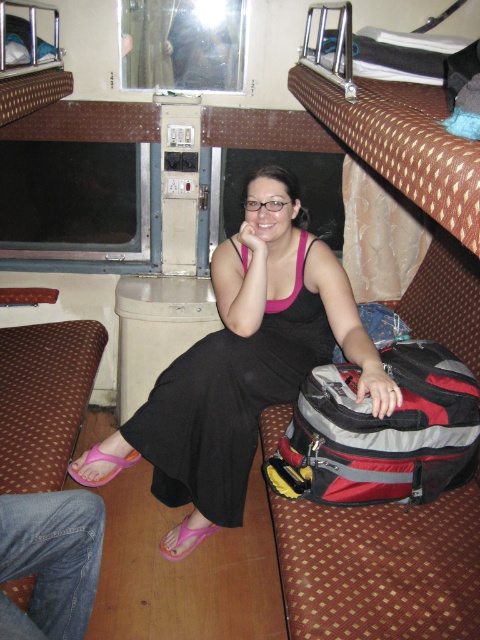
Between black satin dress at center and pink rubber sandal at lower left, which one has less height?

pink rubber sandal at lower left is shorter.

From the picture: Is black satin dress at center closer to the viewer compared to pink rubber sandal at lower left?

That is True.

What do you see at coordinates (250, 356) in the screenshot?
I see `black satin dress at center` at bounding box center [250, 356].

This screenshot has height=640, width=480. Identify the location of black satin dress at center. click(x=250, y=356).

Is pink rubber sandal at lower left shorter than pink fabric sandal at lower center?

No, pink rubber sandal at lower left is not shorter than pink fabric sandal at lower center.

Is pink rubber sandal at lower left to the right of pink fabric sandal at lower center from the viewer's perspective?

Incorrect, pink rubber sandal at lower left is not on the right side of pink fabric sandal at lower center.

The height and width of the screenshot is (640, 480). What do you see at coordinates (103, 460) in the screenshot?
I see `pink rubber sandal at lower left` at bounding box center [103, 460].

Locate an element on the screen. The height and width of the screenshot is (640, 480). pink rubber sandal at lower left is located at coordinates pos(103,460).

Measure the distance between black satin dress at center and pink fabric sandal at lower center.

A distance of 22.48 inches exists between black satin dress at center and pink fabric sandal at lower center.

Where is `black satin dress at center`? This screenshot has height=640, width=480. black satin dress at center is located at coordinates (250, 356).

What do you see at coordinates (250, 356) in the screenshot?
I see `black satin dress at center` at bounding box center [250, 356].

I want to click on black satin dress at center, so click(250, 356).